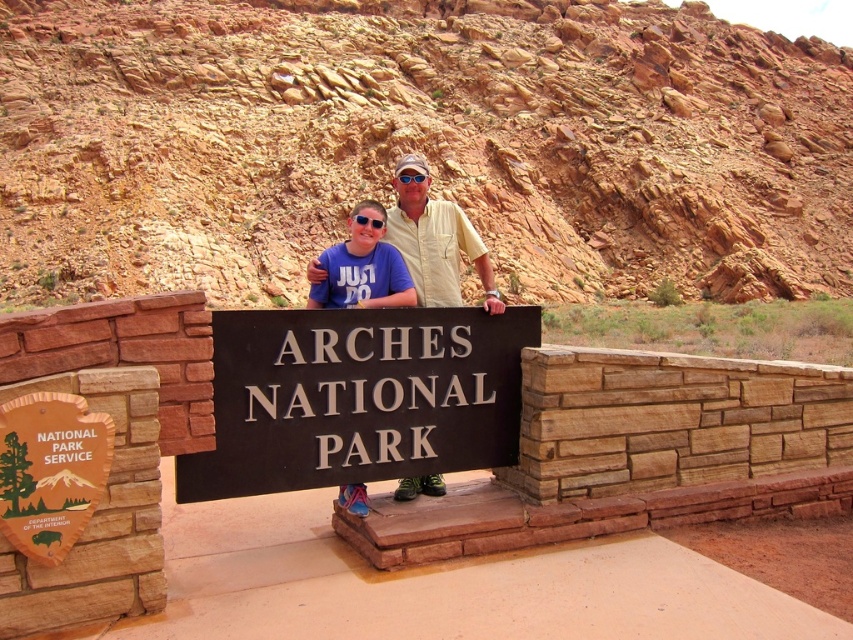
You are standing at the entrance of Arches National Park and want to take a photo of the black metal sign at center. If your camera can focus on objects up to 30 feet away, will it be able to capture the sign clearly?

The black metal sign at center is 28.71 feet away from the viewer. Since the camera can focus up to 30 feet, it will be able to capture the sign clearly.

You are a photographer trying to capture the black metal sign at center and the matte yellow shirt at center in the same frame. Which object should you focus on first to ensure both are in focus?

The black metal sign at center is further to the viewer than the matte yellow shirt at center, so you should focus on the black metal sign at center first to ensure both are in focus.

You are a photographer trying to capture both the matte yellow shirt at center and the blue fabric shirt at center in a single frame. Based on their positions, which shirt should you adjust your camera angle to focus on first to ensure both are in the shot?

The matte yellow shirt at center is wider than the blue fabric shirt at center, so you should focus on the wider matte yellow shirt at center first to ensure both fit within the camera frame.